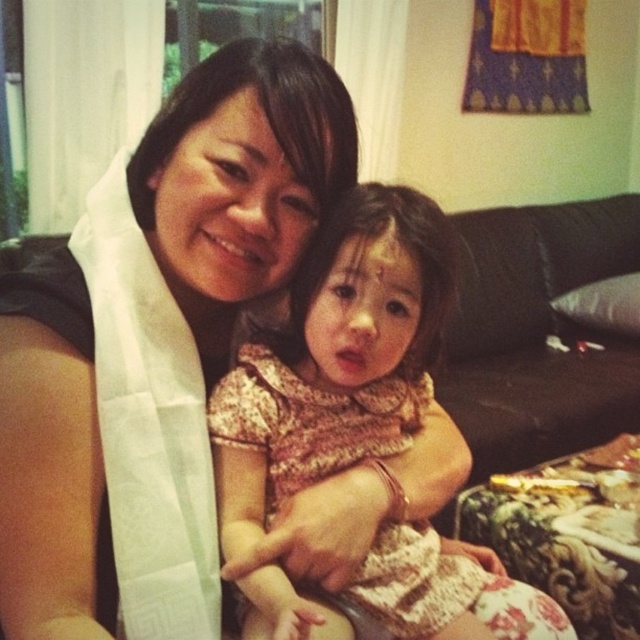
Question: Is floral dress at center to the right of matte white scarf at center from the viewer's perspective?

Choices:
 (A) yes
 (B) no

Answer: (A)

Question: Among these objects, which one is nearest to the camera?

Choices:
 (A) black leather couch at center
 (B) matte white scarf at center

Answer: (B)

Question: Does floral dress at center lie behind black leather couch at center?

Choices:
 (A) no
 (B) yes

Answer: (A)

Question: Does floral dress at center have a larger size compared to matte white scarf at center?

Choices:
 (A) yes
 (B) no

Answer: (A)

Question: Which point is closer to the camera?

Choices:
 (A) matte white scarf at center
 (B) floral dress at center
 (C) black leather couch at center

Answer: (B)

Question: Which object is positioned farthest from the black leather couch at center?

Choices:
 (A) matte white scarf at center
 (B) floral dress at center

Answer: (A)